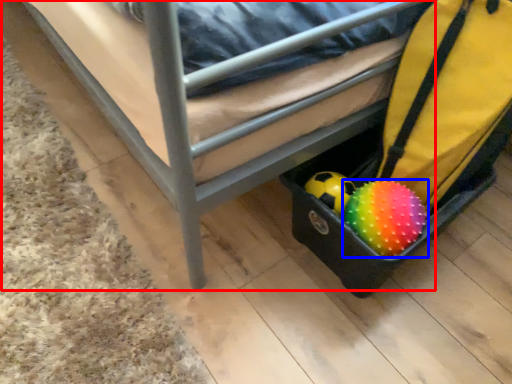
Question: Which object appears farthest to the camera in this image, furniture (highlighted by a red box) or ball (highlighted by a blue box)?

Choices:
 (A) furniture
 (B) ball

Answer: (B)